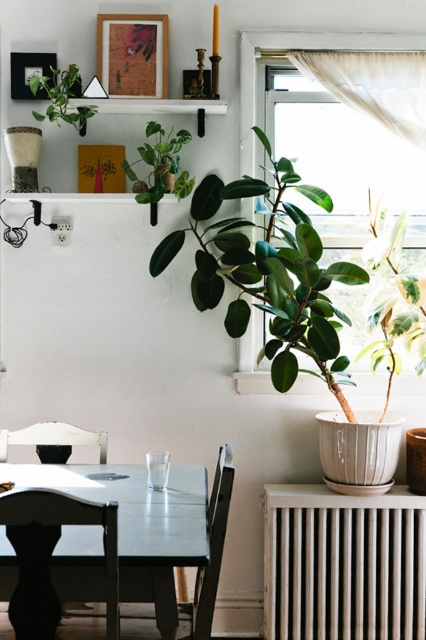
Question: Is green rubber plant at center further to the viewer compared to white textured radiator at lower right?

Choices:
 (A) no
 (B) yes

Answer: (A)

Question: Which point is closer to the camera?

Choices:
 (A) white textured radiator at lower right
 (B) black wood chair at lower left
 (C) transparent fabric at upper right
 (D) green matte plant at upper left

Answer: (B)

Question: Is green rubber plant at center to the right of green matte plant at upper center from the viewer's perspective?

Choices:
 (A) no
 (B) yes

Answer: (B)

Question: Can you confirm if green rubber plant at center is wider than white textured radiator at lower right?

Choices:
 (A) yes
 (B) no

Answer: (A)

Question: Estimate the real-world distances between objects in this image. Which object is closer to the green rubber plant at center?

Choices:
 (A) transparent fabric at upper right
 (B) green matte plant at upper left
 (C) black wood chair at lower left

Answer: (A)

Question: Based on their relative distances, which object is nearer to the white textured radiator at lower right?

Choices:
 (A) green matte plant at upper center
 (B) green matte plant at upper left
 (C) black wood chair at lower left

Answer: (C)